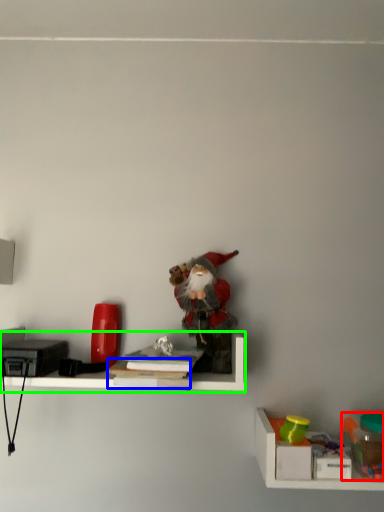
Question: Which object is the closest to the toy (highlighted by a red box)? Choose among these: book (highlighted by a blue box) or shelf (highlighted by a green box).

Choices:
 (A) book
 (B) shelf

Answer: (B)